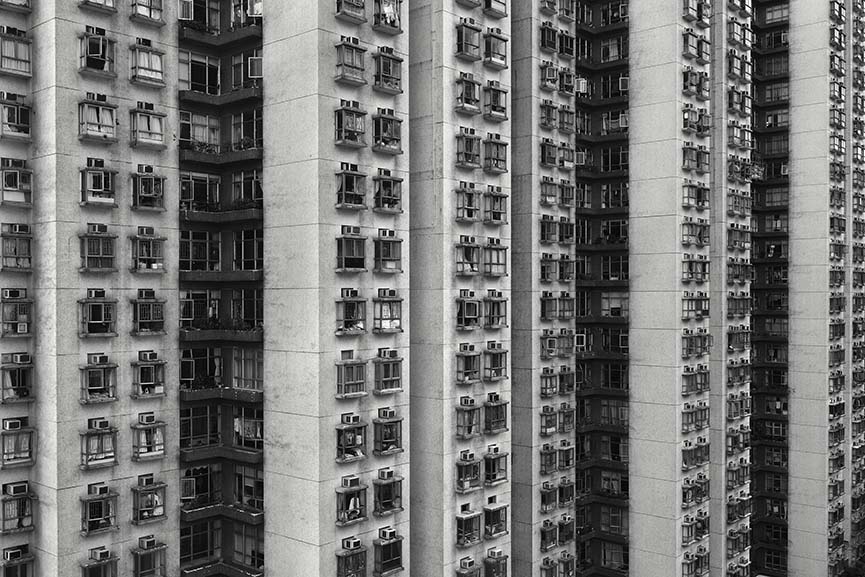
Where is `right wall opening absent an air conditioning unit`? The height and width of the screenshot is (577, 865). right wall opening absent an air conditioning unit is located at coordinates (494, 500).